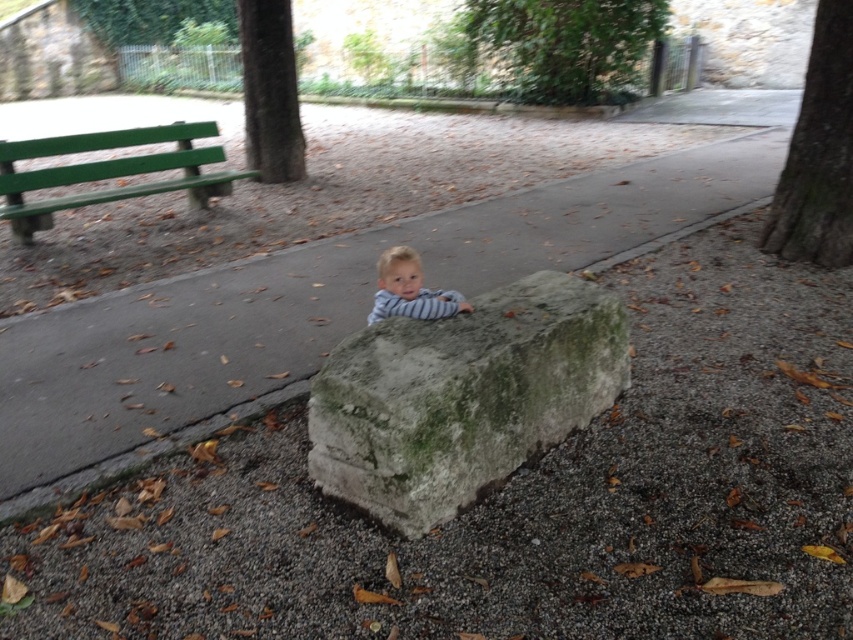
Question: Which of the following is the closest to the observer?

Choices:
 (A) gray concrete pavement at center
 (B) striped fabric toddler at center

Answer: (B)

Question: Does gray concrete pavement at center come in front of green rough bark tree at upper center?

Choices:
 (A) no
 (B) yes

Answer: (B)

Question: Which object is farther from the camera taking this photo?

Choices:
 (A) green rough bark tree at upper center
 (B) green mossy stone at center
 (C) striped fabric toddler at center

Answer: (A)

Question: Is green rough bark tree at upper center behind striped fabric toddler at center?

Choices:
 (A) yes
 (B) no

Answer: (A)

Question: Is green rough bark tree at upper center above striped fabric toddler at center?

Choices:
 (A) no
 (B) yes

Answer: (B)

Question: Which of these objects is positioned closest to the striped fabric toddler at center?

Choices:
 (A) gray concrete pavement at center
 (B) green rough bark tree at upper center
 (C) green rough bark tree at right

Answer: (A)